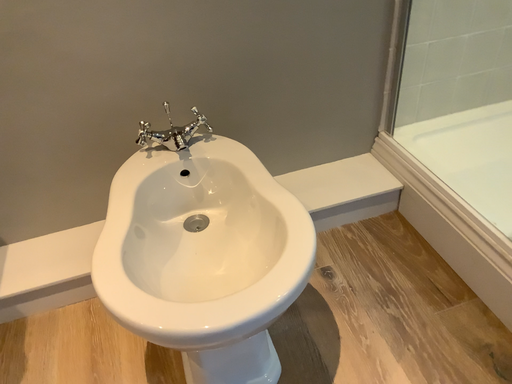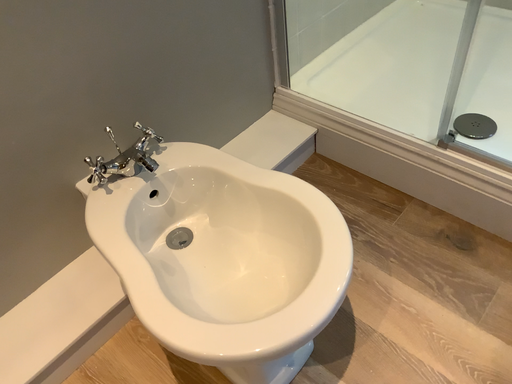
Question: How did the camera likely rotate when shooting the video?

Choices:
 (A) rotated left
 (B) rotated right

Answer: (B)